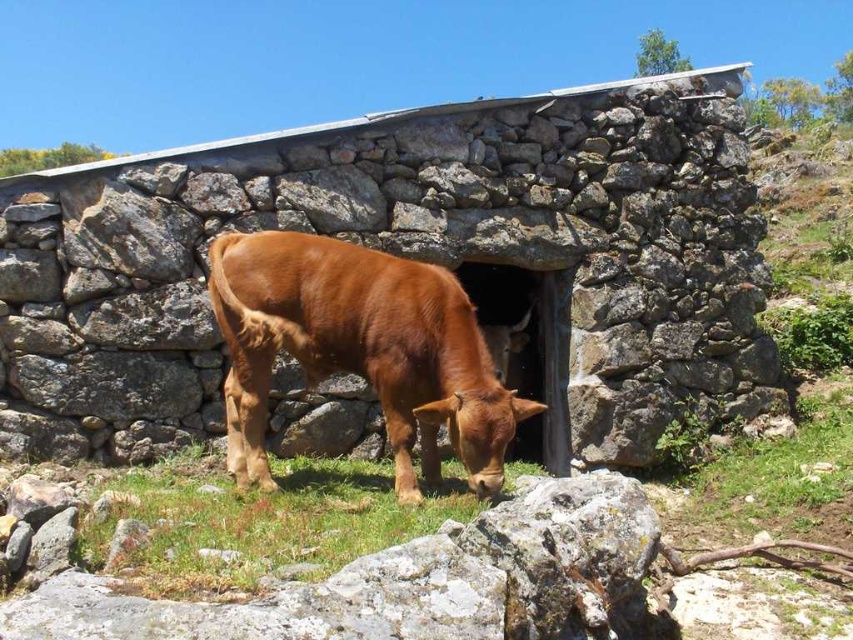
You are a farmer who wants to feed the brown matte cow at center. The green grass at lower center is the only source of food available. Can you reach the cow with a 30 inch long pitchfork without moving closer to the cow?

The distance between the brown matte cow at center and the green grass at lower center is 25.36 inches, so yes, the farmer can reach the cow with a 30 inch long pitchfork since it is longer than the distance required.